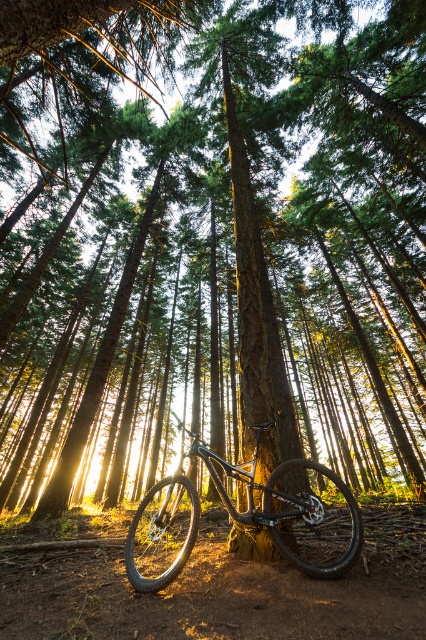
Based on the photo, you are planning to ride the glossy metallic bicycle at center along the dirt track at center. Based on their positions, which direction should you head to start riding from the bicycle to the dirt track?

The dirt track at center is positioned on the right side of the glossy metallic bicycle at center, so you should head to the right to start riding from the bicycle to the dirt track.

You are a hiker who wants to ride the glossy metallic bicycle at center down the dirt track at center. Can you start riding the bicycle directly from its current position?

The dirt track at center is located below the glossy metallic bicycle at center, so yes, the bicycle can be ridden down the track since it is positioned above the track.